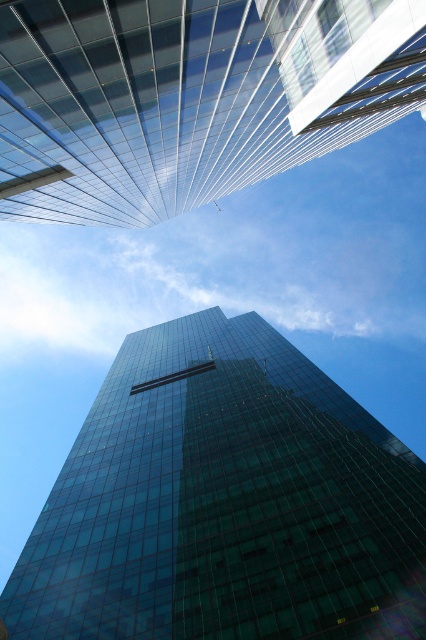
Question: Does transparent glass tower at center have a lesser width compared to transparent glass building at upper center?

Choices:
 (A) yes
 (B) no

Answer: (A)

Question: Does transparent glass tower at center appear under transparent glass building at upper center?

Choices:
 (A) no
 (B) yes

Answer: (B)

Question: Which of the following is the farthest from the observer?

Choices:
 (A) transparent glass tower at center
 (B) transparent glass building at upper center

Answer: (A)

Question: Can you confirm if transparent glass tower at center is bigger than transparent glass building at upper center?

Choices:
 (A) yes
 (B) no

Answer: (A)

Question: Which of the following is the closest to the observer?

Choices:
 (A) transparent glass tower at center
 (B) transparent glass building at upper center

Answer: (B)

Question: Which point is farther to the camera?

Choices:
 (A) (290, 628)
 (B) (94, 188)

Answer: (B)